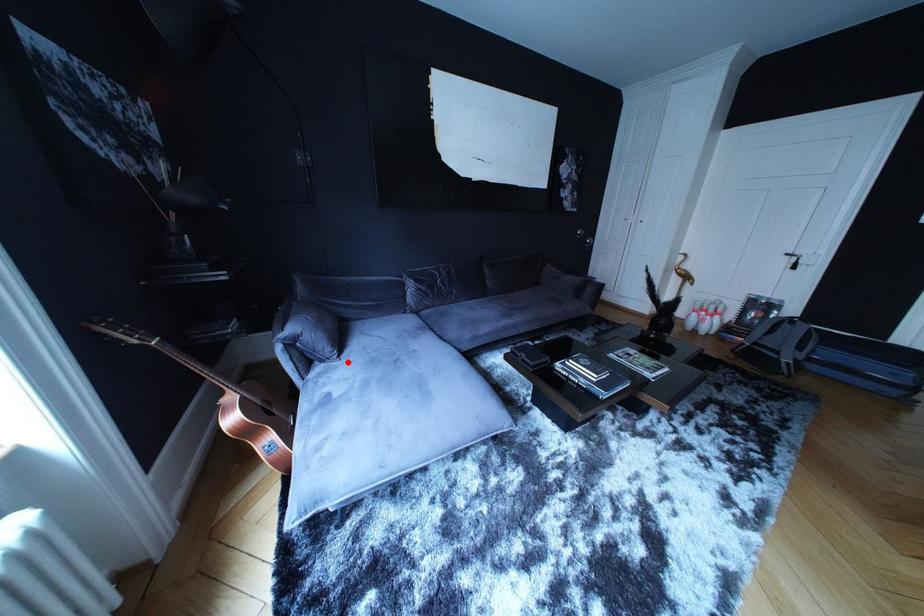
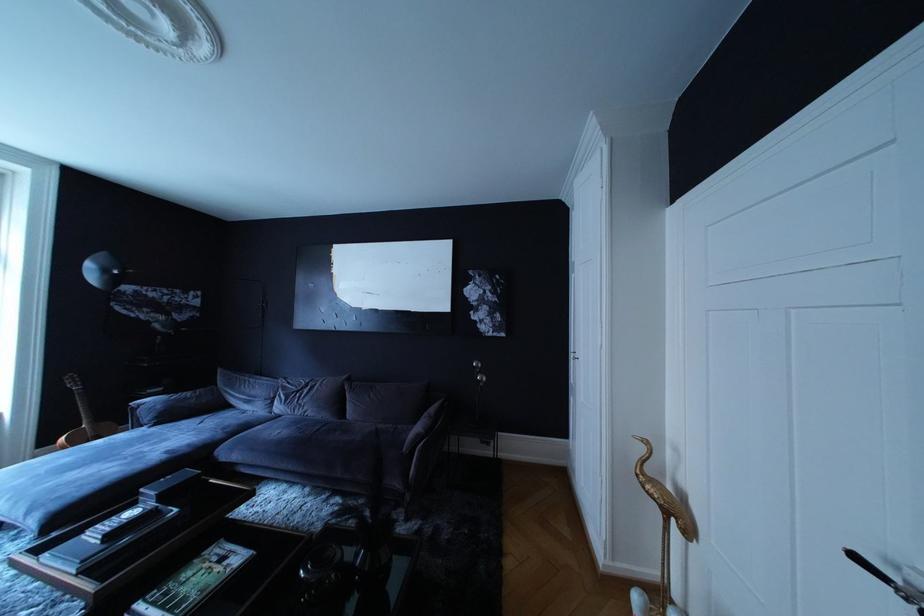
Locate, in the second image, the point that corresponds to the highlighted location in the first image.

(163, 432)